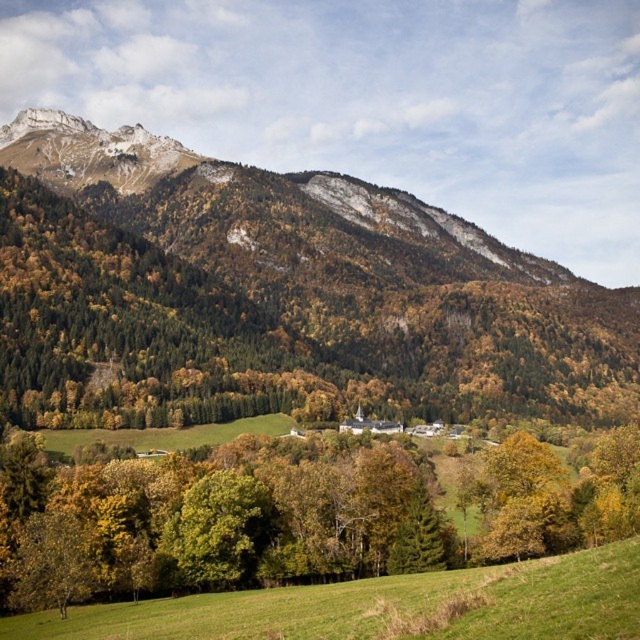
You are a hiker standing at the edge of the green grassy field at lower center and want to take a photo of the green matte tree at center. Which direction should you face to ensure the tree is fully in the frame?

Since the green matte tree at center is wider than the green grassy field at lower center, you should face towards the center of the field to capture the entire width of the tree in your photo.

Based on the scene description, what are the coordinates of the green forested mountain at upper center in the image?

The green forested mountain at upper center is located at coordinates approximately 0.452 in the x direction and 0.434 in the y direction.

You are standing in the green grassy field at lower center and want to reach the green forested mountain at upper center. Which direction should you look to see the mountain?

You should look upward because the green forested mountain at upper center is above the green grassy field at lower center.